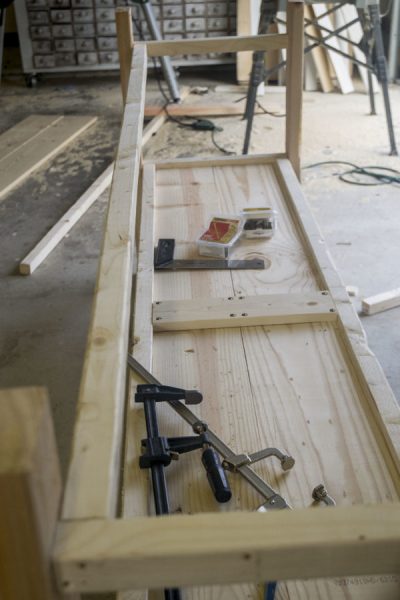
Where is `single thin slat of square wood`? single thin slat of square wood is located at coordinates (70, 219).